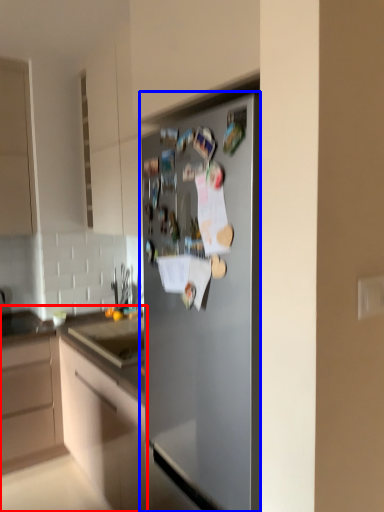
Question: Which object appears closest to the camera in this image, cabinetry (highlighted by a red box) or refrigerator (highlighted by a blue box)?

Choices:
 (A) cabinetry
 (B) refrigerator

Answer: (B)